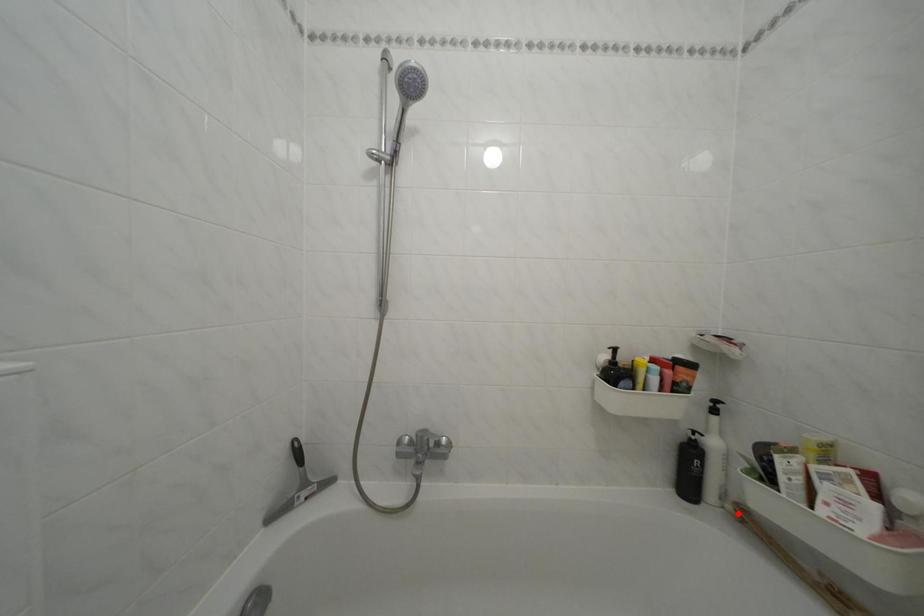
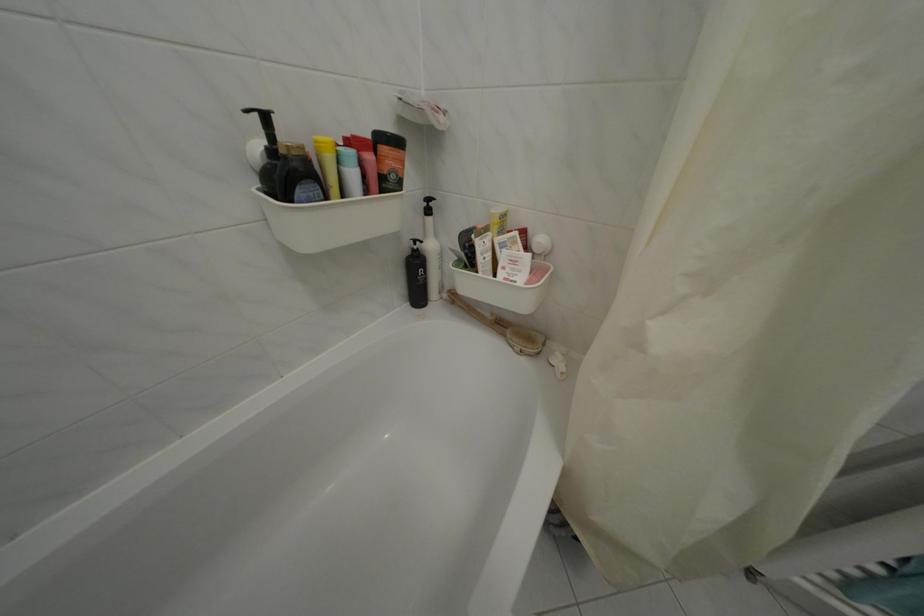
In the second image, find the point that corresponds to the highlighted location in the first image.

(454, 302)